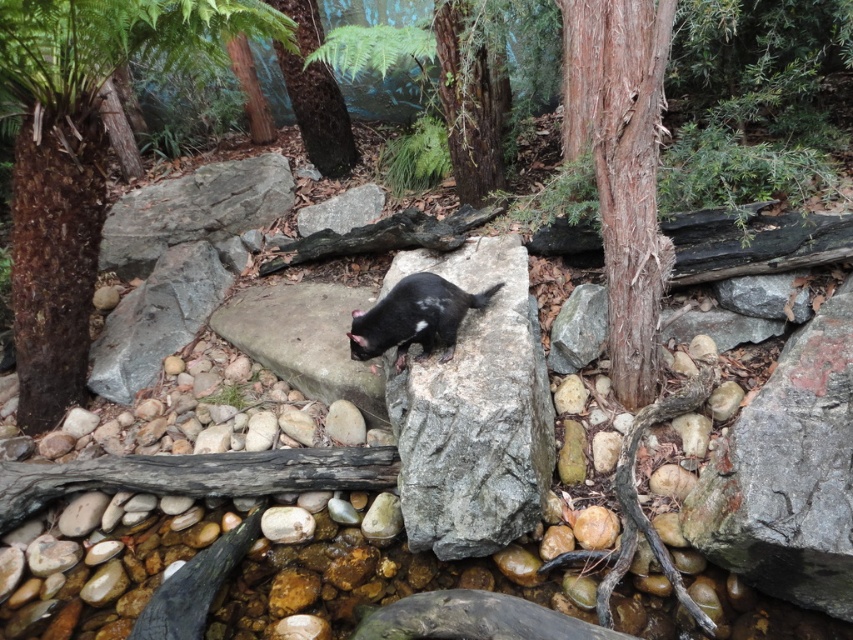
Measure the distance between brown rough bark tree at upper center and brown rough tree trunk at upper center.

A distance of 5.39 feet exists between brown rough bark tree at upper center and brown rough tree trunk at upper center.

Who is more forward, (465, 81) or (310, 100)?

Point (465, 81) is more forward.

Between point (488, 92) and point (318, 44), which one is positioned behind?

Point (318, 44)

You are a GUI agent. You are given a task and a screenshot of the screen. Output one action in this format:
    pyautogui.click(x=<x>, y=<y>)
    Task: Click on the brown rough bark tree at upper center
    This screenshot has width=853, height=640.
    Given the screenshot: What is the action you would take?
    pyautogui.click(x=469, y=100)

Is brown rough tree at center further to camera compared to brown rough tree trunk at upper center?

No, it is not.

Where is `brown rough tree at center`? The width and height of the screenshot is (853, 640). brown rough tree at center is located at coordinates (80, 160).

Is point (53, 74) more distant than point (312, 109)?

No, it is not.

Locate an element on the screen. This screenshot has width=853, height=640. brown rough tree at center is located at coordinates (80, 160).

Consider the image. Is brown rough bark tree at upper center positioned in front of black furry tasmanian devil at center?

That is False.

At what (x,y) coordinates should I click in order to perform the action: click on brown rough bark tree at upper center. Please return your answer as a coordinate pair (x, y). The height and width of the screenshot is (640, 853). Looking at the image, I should click on (469, 100).